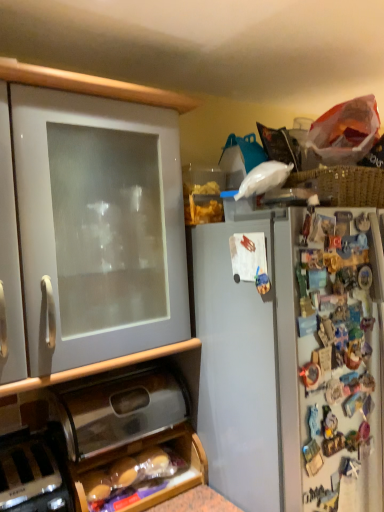
Question: Looking at the image, does black plastic toaster at lower left seem bigger or smaller compared to metallic silver breadbox at lower center, the second cabinetry viewed from the top?

Choices:
 (A) small
 (B) big

Answer: (A)

Question: From the image's perspective, is black plastic toaster at lower left above or below metallic silver breadbox at lower center, the second cabinetry viewed from the top?

Choices:
 (A) above
 (B) below

Answer: (B)

Question: Which object is the farthest from the black plastic toaster at lower left?

Choices:
 (A) white matte cabinet at left, the 1th cabinetry positioned from the top
 (B) metallic silver breadbox at lower center, the first cabinetry from the bottom

Answer: (A)

Question: Estimate the real-world distances between objects in this image. Which object is closer to the metallic silver breadbox at lower center, the first cabinetry from the bottom?

Choices:
 (A) white matte cabinet at left, the 1th cabinetry positioned from the top
 (B) black plastic toaster at lower left

Answer: (A)